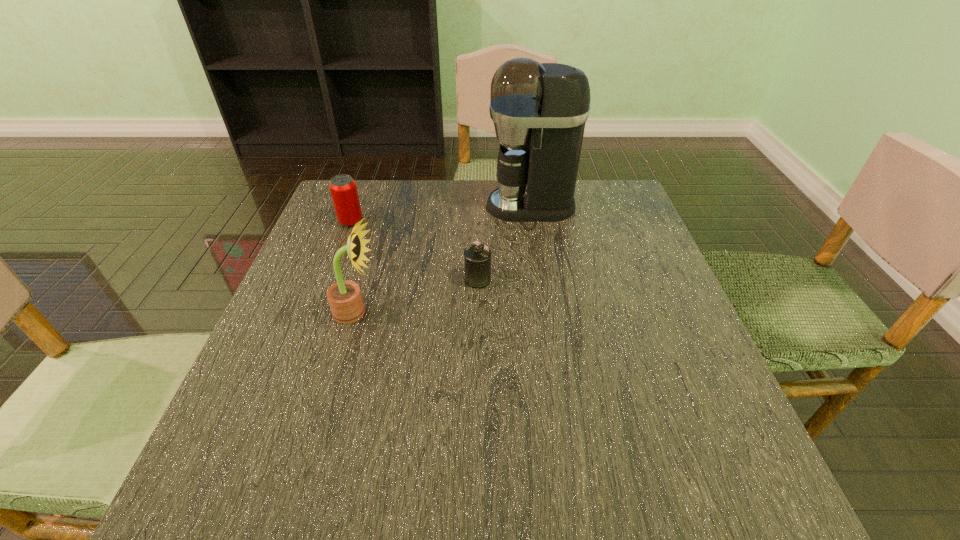
Where is `free region at the far edge of the desktop`? free region at the far edge of the desktop is located at coordinates (576, 223).

In the image, there is a desktop. Where is `vacant region at the left edge`? The width and height of the screenshot is (960, 540). vacant region at the left edge is located at coordinates (324, 282).

Where is `free space at the right edge`? The width and height of the screenshot is (960, 540). free space at the right edge is located at coordinates (670, 410).

Image resolution: width=960 pixels, height=540 pixels. In order to click on free location at the far left corner of the desktop in this screenshot , I will do `click(372, 185)`.

Where is `free space at the near right corner of the desktop`? free space at the near right corner of the desktop is located at coordinates (728, 471).

Locate an element on the screen. vacant space that is in between the right can and the coffee maker is located at coordinates (504, 243).

You are a GUI agent. You are given a task and a screenshot of the screen. Output one action in this format:
    pyautogui.click(x=<x>, y=<y>)
    Task: Click on the empty location between the tallest object and the third shortest object
    The width and height of the screenshot is (960, 540).
    Given the screenshot: What is the action you would take?
    pyautogui.click(x=444, y=259)

Where is `free point between the sunflower and the right can`? The width and height of the screenshot is (960, 540). free point between the sunflower and the right can is located at coordinates (417, 296).

What are the coordinates of `free point between the shorter can and the coffee maker` in the screenshot? It's located at (504, 243).

Find the location of `vacant point located between the second shortest object and the second tallest object`. vacant point located between the second shortest object and the second tallest object is located at coordinates (353, 267).